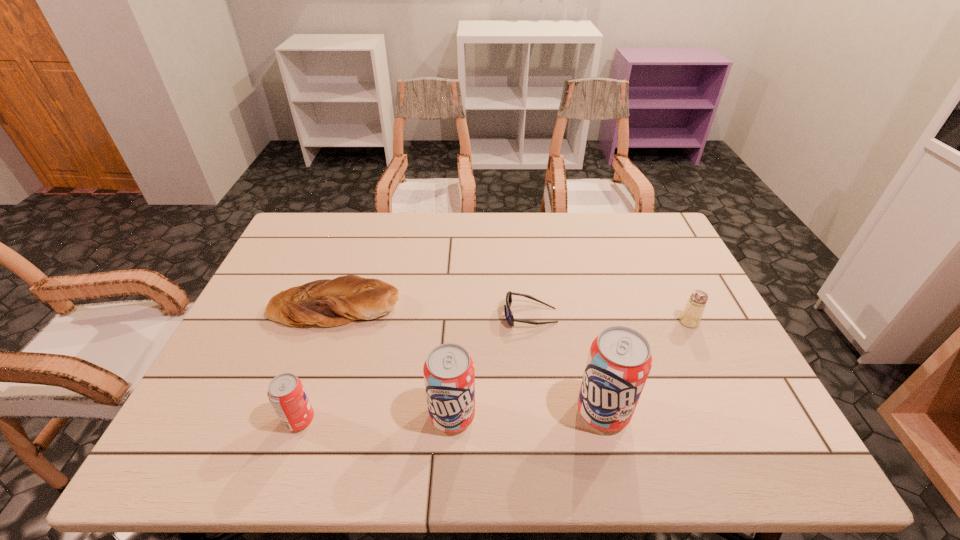
What are the coordinates of `free point that satisfies the following two spatial constraints: 1. on the front side of the bread; 2. on the left side of the second shortest soda can` in the screenshot? It's located at (297, 416).

Identify the location of vacant area in the image that satisfies the following two spatial constraints: 1. on the front-facing side of the rightmost soda can; 2. on the left side of the shortest object. The width and height of the screenshot is (960, 540). (541, 412).

Where is `vacant area in the image that satisfies the following two spatial constraints: 1. on the front-facing side of the shortest object; 2. on the back side of the rightmost soda can`? vacant area in the image that satisfies the following two spatial constraints: 1. on the front-facing side of the shortest object; 2. on the back side of the rightmost soda can is located at coordinates (541, 412).

Identify the location of vacant space that satisfies the following two spatial constraints: 1. on the back side of the fifth object from left to right; 2. on the left side of the fourth tallest object. This screenshot has width=960, height=540. (582, 322).

The image size is (960, 540). Identify the location of vacant space that satisfies the following two spatial constraints: 1. on the back side of the rightmost object; 2. on the front-facing side of the sunglasses. click(x=685, y=315).

Identify the location of free spot that satisfies the following two spatial constraints: 1. on the back side of the second object from right to left; 2. on the right side of the fourth tallest object. Image resolution: width=960 pixels, height=540 pixels. (582, 322).